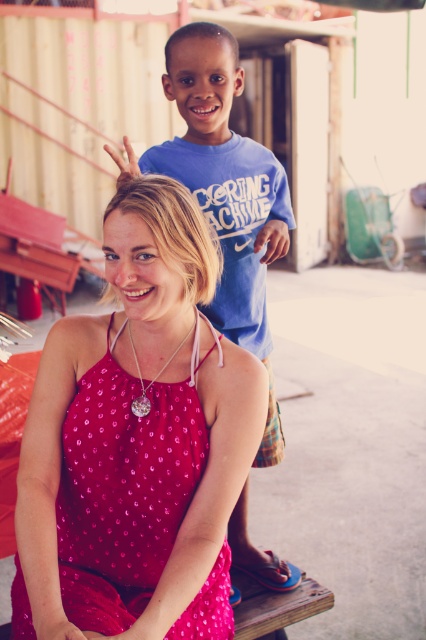
You are taking a photo of the woman in the red dress and the boy in the blue T shirt. You want to focus on the woman first. Which point should you adjust your focus to first, point (19,598) or point (176,352)?

Point (19,598) is closer to the camera than point (176,352), so you should adjust your focus to point (19,598) first to focus on the woman in the red dress.

You are a photographer trying to capture the best shot of the shiny red dress at center and the silver metallic pendant at center. Since the camera can only focus on one object at a time, which object should you choose to ensure the larger one is in focus?

The shiny red dress at center has a greater height compared to the silver metallic pendant at center. Therefore, you should focus on the shiny red dress at center to ensure the larger object is in focus.